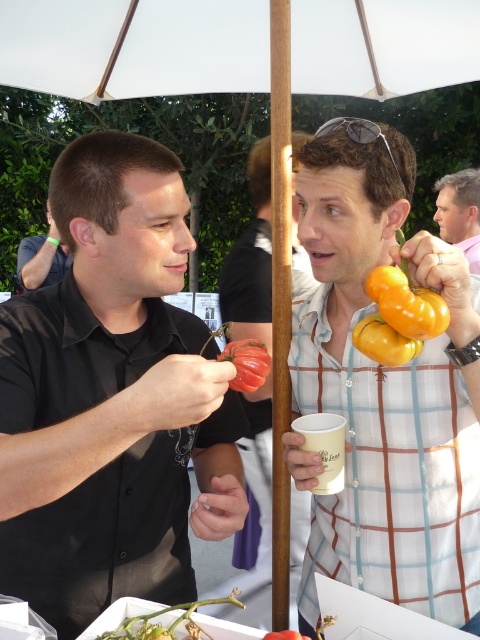
You are a photographer trying to capture a candid shot of the matte black shirt at left and the metallic reflective sunglasses at upper center. Since you want to avoid reflections on the sunglasses, which object should you adjust your camera angle to focus on first?

The matte black shirt at left is positioned under metallic reflective sunglasses at upper center. To avoid reflections on the sunglasses, focus on the matte black shirt at left first, then adjust the angle for the sunglasses.

You are a photographer standing at the center of the scene. You want to take a photo that includes both the black shirt at left and the yellow matte bell pepper at upper right. What is the minimum distance you need to move to ensure both are in frame?

The minimum distance you need to move is 8.32 feet to ensure both the black shirt at left and the yellow matte bell pepper at upper right are in frame since they are 8.32 feet apart.

You are a photographer trying to capture both the matte yellow squash at right and the yellow matte pepper at center right in the same frame. Based on their positions, which one is closer to the camera?

The yellow matte pepper at center right is behind the matte yellow squash at right, so the matte yellow squash at right is closer to the camera.